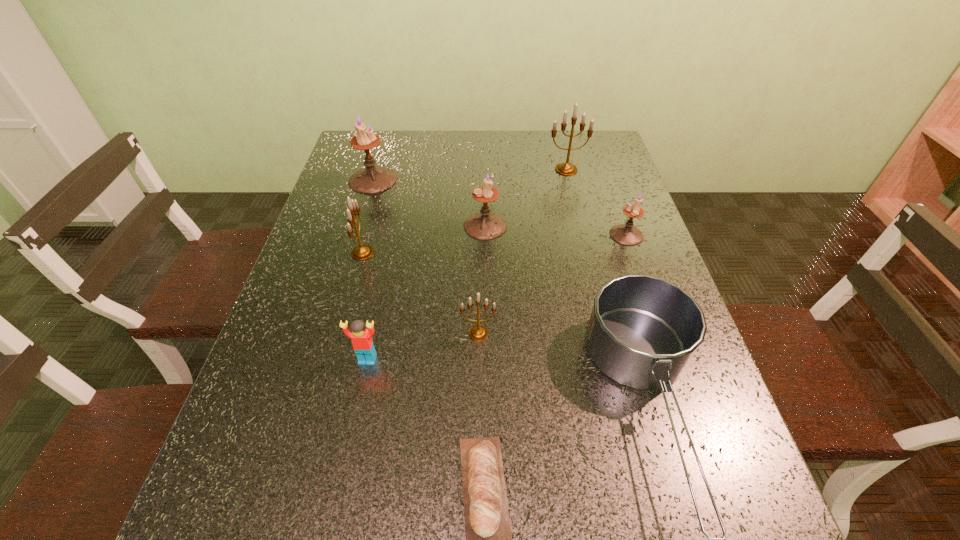
Find the location of a particular element. Image resolution: width=960 pixels, height=540 pixels. the farthest purple candle holder is located at coordinates (372, 179).

Locate an element on the screen. This screenshot has width=960, height=540. the leftmost purple candle holder is located at coordinates 372,179.

Where is `the biggest gold candelabrum`? The height and width of the screenshot is (540, 960). the biggest gold candelabrum is located at coordinates (567, 169).

Where is `the farthest gold candelabrum`? the farthest gold candelabrum is located at coordinates (567, 169).

Find the location of a particular element. The height and width of the screenshot is (540, 960). the second smallest purple candle holder is located at coordinates click(485, 225).

This screenshot has height=540, width=960. I want to click on the leftmost gold candelabrum, so click(361, 252).

Image resolution: width=960 pixels, height=540 pixels. What are the coordinates of `the second nearest gold candelabrum` in the screenshot? It's located at (361, 252).

Where is `the smallest purple candle holder`? The image size is (960, 540). the smallest purple candle holder is located at coordinates (627, 234).

You are a GUI agent. You are given a task and a screenshot of the screen. Output one action in this format:
    pyautogui.click(x=<x>, y=<y>)
    Task: Click on the rightmost candelabrum
    This screenshot has width=960, height=540.
    Given the screenshot: What is the action you would take?
    pyautogui.click(x=627, y=234)

This screenshot has width=960, height=540. I want to click on the smallest gold candelabrum, so click(478, 332).